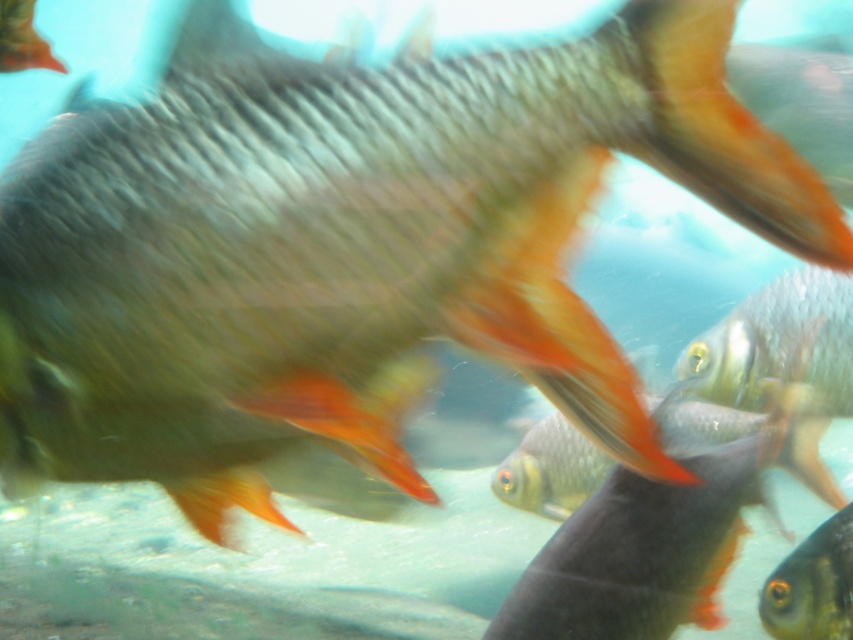
You are a marine biologist observing underwater. You notice the shiny silver fish at center and the matte orange fish at upper left. Which fish is closer to your viewpoint?

The shiny silver fish at center is closer to your viewpoint because it is in front of the matte orange fish at upper left.

You are an underwater photographer trying to capture a photo of the shiny silver fish at center and the matte orange fish at upper left. Which fish is positioned to the right of the other?

The shiny silver fish at center is positioned to the right of the matte orange fish at upper left.